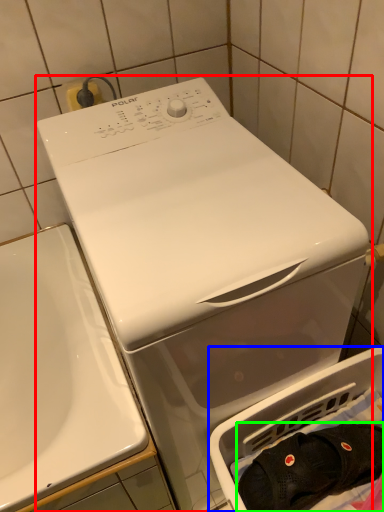
Question: Which object is the closest to the washing machine (highlighted by a red box)? Choose among these: dish washer (highlighted by a blue box) or clothing (highlighted by a green box).

Choices:
 (A) dish washer
 (B) clothing

Answer: (A)